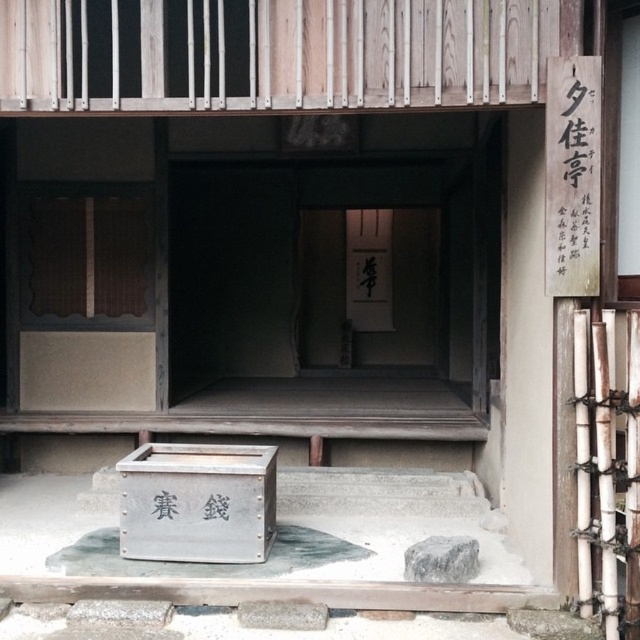
Question: Which point appears farthest from the camera in this image?

Choices:
 (A) (561, 93)
 (B) (387, 330)

Answer: (B)

Question: Among these points, which one is nearest to the camera?

Choices:
 (A) (388, 240)
 (B) (598, 136)

Answer: (B)

Question: Is black wood sign at upper right to the right of white paper at center from the viewer's perspective?

Choices:
 (A) no
 (B) yes

Answer: (B)

Question: Which of the following is the closest to the observer?

Choices:
 (A) white paper at center
 (B) black wood sign at upper right

Answer: (B)

Question: Is black wood sign at upper right above white paper at center?

Choices:
 (A) no
 (B) yes

Answer: (B)

Question: Can you confirm if black wood sign at upper right is positioned above white paper at center?

Choices:
 (A) no
 (B) yes

Answer: (B)